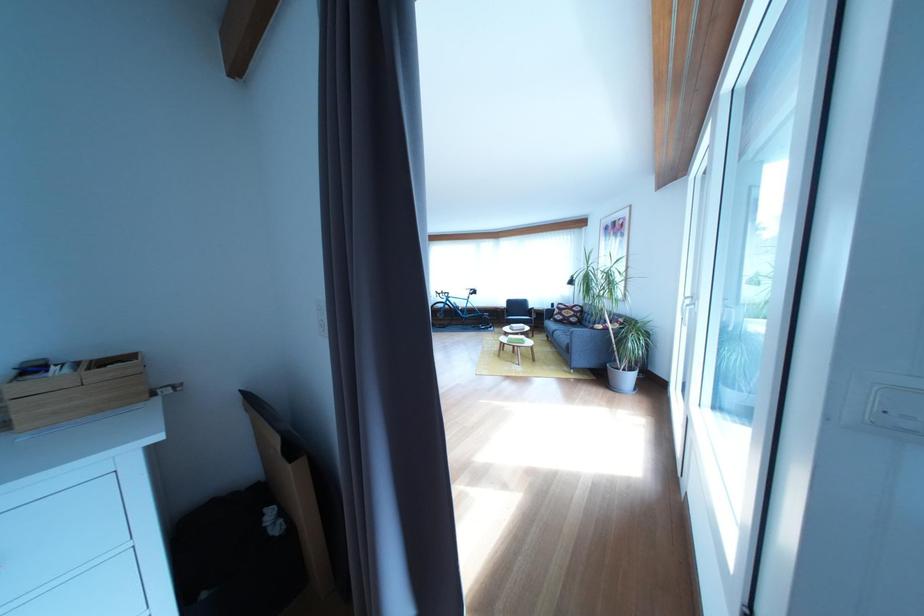
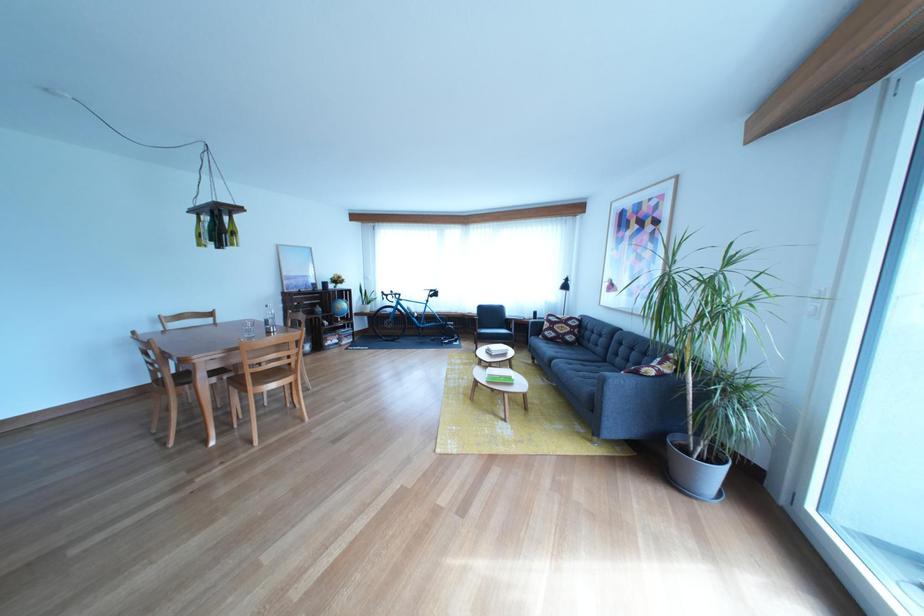
Question: Which direction would the cameraman need to move to produce the second image? Reply with the corresponding letter.

Choices:
 (A) Left
 (B) Right
 (C) Forward
 (D) Backward

Answer: (C)